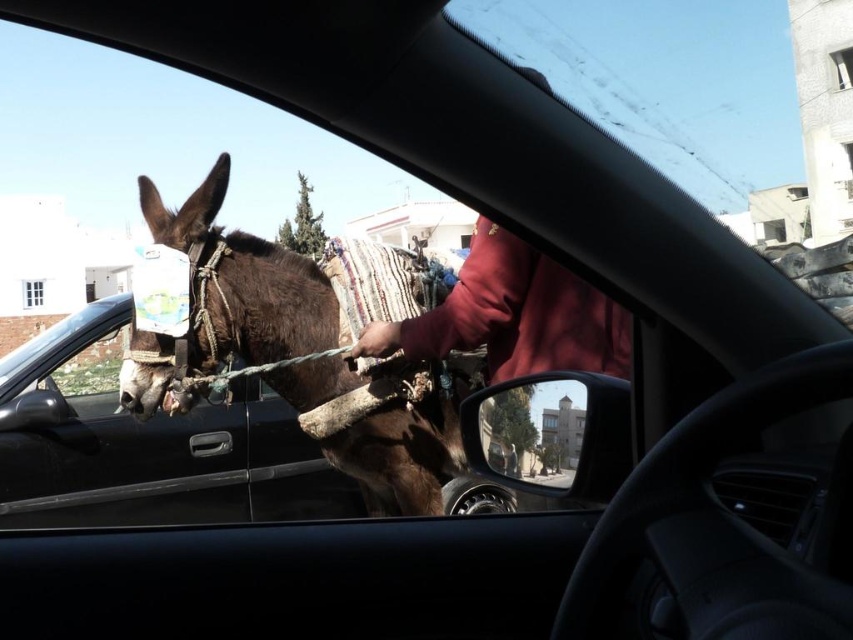
Can you confirm if brown fuzzy mule at left is taller than red fleece jacket at center?

Yes, brown fuzzy mule at left is taller than red fleece jacket at center.

Is point (173, 243) less distant than point (407, 342)?

No, (173, 243) is further to viewer.

The height and width of the screenshot is (640, 853). I want to click on brown fuzzy mule at left, so click(241, 284).